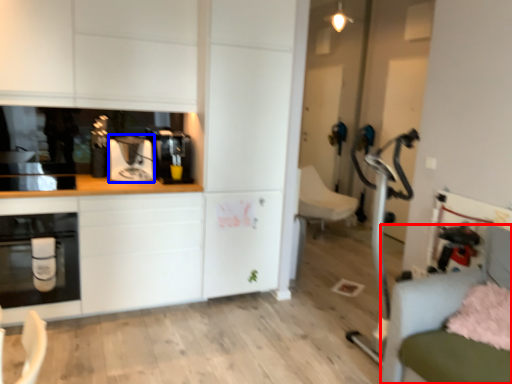
Question: Which of the following is the farthest to the observer, swivel chair (highlighted by a red box) or coffee machine (highlighted by a blue box)?

Choices:
 (A) swivel chair
 (B) coffee machine

Answer: (B)